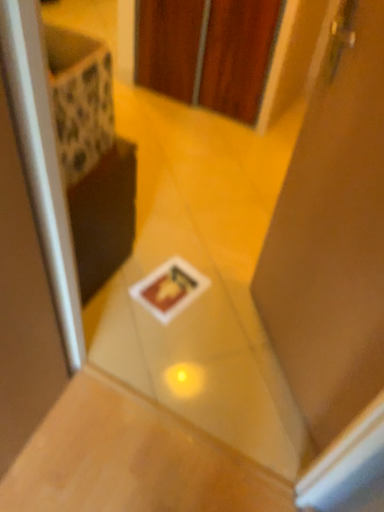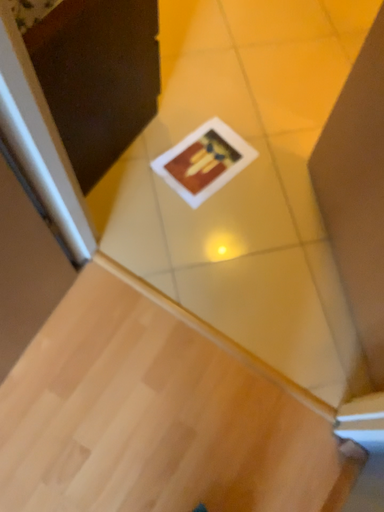
Question: How did the camera likely rotate when shooting the video?

Choices:
 (A) rotated upward
 (B) rotated downward

Answer: (B)